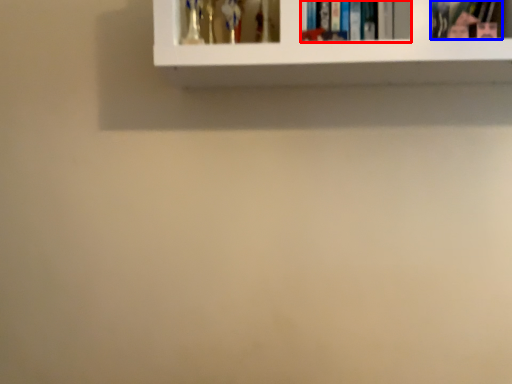
Question: Which point is further to the camera, book (highlighted by a red box) or book (highlighted by a blue box)?

Choices:
 (A) book
 (B) book

Answer: (A)